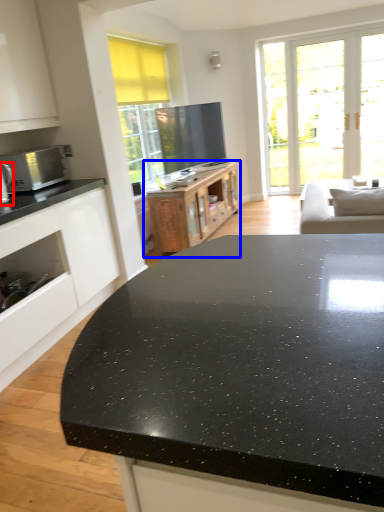
Question: Which of the following is the closest to the observer, appliance (highlighted by a red box) or cabinetry (highlighted by a blue box)?

Choices:
 (A) appliance
 (B) cabinetry

Answer: (A)